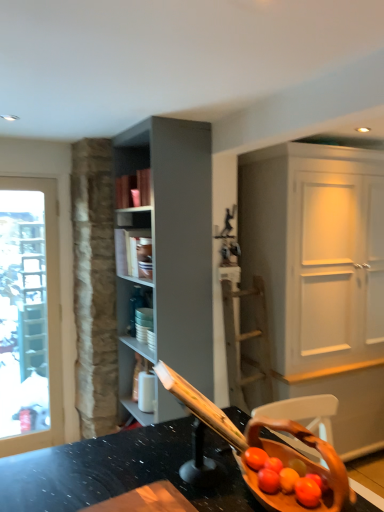
The image size is (384, 512). What do you see at coordinates (134, 243) in the screenshot?
I see `matte gray shelf at center` at bounding box center [134, 243].

Identify the location of matte gray shelf at center. (134, 243).

Where is `white matte cabinet at right`? This screenshot has width=384, height=512. white matte cabinet at right is located at coordinates (321, 276).

What is the approximate height of white matte cabinet at right?

It is 6.82 feet.

The width and height of the screenshot is (384, 512). Describe the element at coordinates (321, 276) in the screenshot. I see `white matte cabinet at right` at that location.

Where is `matte gray shelf at center`? The width and height of the screenshot is (384, 512). matte gray shelf at center is located at coordinates (134, 243).

Does matte gray shelf at center appear on the right side of white matte cabinet at right?

In fact, matte gray shelf at center is to the left of white matte cabinet at right.

Who is more distant, matte gray shelf at center or white matte cabinet at right?

matte gray shelf at center is more distant.

Considering the points (145, 232) and (354, 199), which point is in front, point (145, 232) or point (354, 199)?

The point (145, 232) is more forward.

From the image's perspective, is matte gray shelf at center on white matte cabinet at right?

Yes, from the image's perspective, matte gray shelf at center is on top of white matte cabinet at right.

From a real-world perspective, is matte gray shelf at center beneath white matte cabinet at right?

No, from a real-world perspective, matte gray shelf at center is not beneath white matte cabinet at right.

Considering the sizes of objects matte gray shelf at center and white matte cabinet at right in the image provided, who is thinner, matte gray shelf at center or white matte cabinet at right?

With smaller width is matte gray shelf at center.

Considering the sizes of objects matte gray shelf at center and white matte cabinet at right in the image provided, who is taller, matte gray shelf at center or white matte cabinet at right?

With more height is white matte cabinet at right.

Can you confirm if matte gray shelf at center is bigger than white matte cabinet at right?

Actually, matte gray shelf at center might be smaller than white matte cabinet at right.

In the scene shown: Is matte gray shelf at center situated inside white matte cabinet at right or outside?

matte gray shelf at center is not enclosed by white matte cabinet at right.

Is matte gray shelf at center in contact with white matte cabinet at right?

matte gray shelf at center and white matte cabinet at right are not in contact.

Does matte gray shelf at center turn towards white matte cabinet at right?

No, matte gray shelf at center is not aimed at white matte cabinet at right.

In the image, there is a matte gray shelf at center. What are the coordinates of `cabinetry below it (from a real-world perspective)` in the screenshot? It's located at (321, 276).

Visually, is white matte cabinet at right positioned to the left or to the right of matte gray shelf at center?

white matte cabinet at right is to the right of matte gray shelf at center.

Is white matte cabinet at right further to camera compared to matte gray shelf at center?

No, white matte cabinet at right is in front of matte gray shelf at center.

Is point (306, 346) farther from camera compared to point (142, 234)?

That is True.

From the image's perspective, is white matte cabinet at right over matte gray shelf at center?

No, from the image's perspective, white matte cabinet at right is not over matte gray shelf at center.

From a real-world perspective, is white matte cabinet at right physically above matte gray shelf at center?

No.

Which of these two, white matte cabinet at right or matte gray shelf at center, is wider?

Wider between the two is white matte cabinet at right.

Does white matte cabinet at right have a greater height compared to matte gray shelf at center?

Yes.

Who is bigger, white matte cabinet at right or matte gray shelf at center?

With larger size is white matte cabinet at right.

Would you say white matte cabinet at right is inside or outside matte gray shelf at center?

white matte cabinet at right lies outside matte gray shelf at center.

Is white matte cabinet at right with matte gray shelf at center?

No, white matte cabinet at right is not next to matte gray shelf at center.

Is white matte cabinet at right turned away from matte gray shelf at center?

No.

Can you tell me how much white matte cabinet at right and matte gray shelf at center differ in facing direction?

The facing directions of white matte cabinet at right and matte gray shelf at center are 87.9 degrees apart.

This screenshot has width=384, height=512. What are the coordinates of `cabinetry in front of the matte gray shelf at center` in the screenshot? It's located at (321, 276).

Find the location of a particular element. This screenshot has height=512, width=384. cabinetry beneath the matte gray shelf at center (from a real-world perspective) is located at coordinates (321, 276).

Where is `shelf that appears above the white matte cabinet at right (from a real-world perspective)`? shelf that appears above the white matte cabinet at right (from a real-world perspective) is located at coordinates (134, 243).